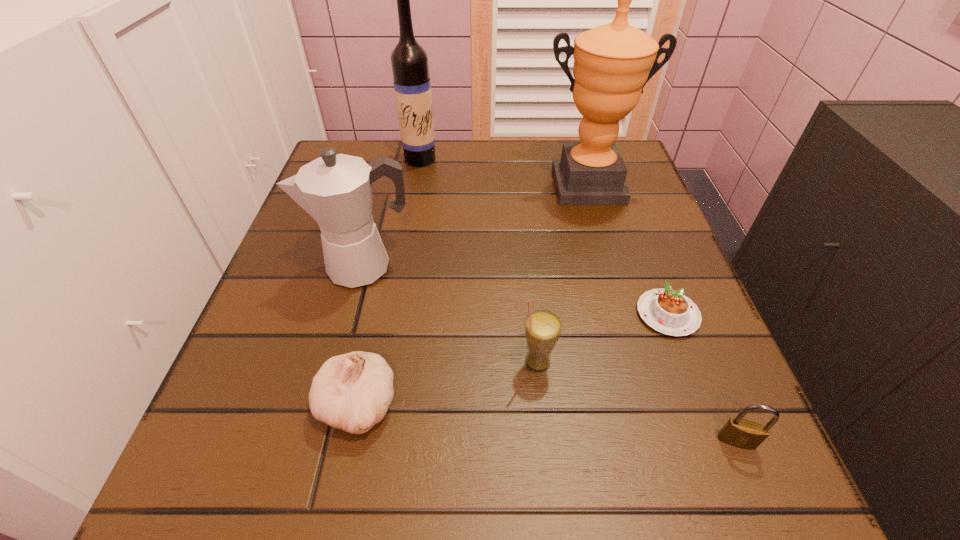
Identify the location of free location at the right edge. (596, 220).

In order to click on free spot at the near right corner of the desktop in this screenshot , I will do coord(727,458).

Identify the location of empty location between the garlic and the fourth nearest object. This screenshot has width=960, height=540. (513, 360).

Locate an element on the screen. free space that is in between the fourth tallest object and the garlic is located at coordinates (447, 384).

Find the location of a particular element. The height and width of the screenshot is (540, 960). free spot between the pudding and the straw for drinking is located at coordinates (602, 339).

Where is `vacant area that lies between the fourth shortest object and the second shortest object`? The width and height of the screenshot is (960, 540). vacant area that lies between the fourth shortest object and the second shortest object is located at coordinates (636, 402).

You are a GUI agent. You are given a task and a screenshot of the screen. Output one action in this format:
    pyautogui.click(x=<x>, y=<y>)
    Task: Click on the free space between the fifth shortest object and the wine bottle
    
    Given the screenshot: What is the action you would take?
    pyautogui.click(x=393, y=213)

At what (x,y) coordinates should I click in order to perform the action: click on free space between the straw for drinking and the garlic. Please return your answer as a coordinate pair (x, y). Image resolution: width=960 pixels, height=540 pixels. Looking at the image, I should click on (447, 384).

At what (x,y) coordinates should I click in order to perform the action: click on free spot between the straw for drinking and the padlock. Please return your answer as a coordinate pair (x, y). The height and width of the screenshot is (540, 960). Looking at the image, I should click on (636, 402).

You are a GUI agent. You are given a task and a screenshot of the screen. Output one action in this format:
    pyautogui.click(x=<x>, y=<y>)
    Task: Click on the vacant area that lies between the fourth object from right to left and the garlic
    
    Given the screenshot: What is the action you would take?
    pyautogui.click(x=447, y=384)